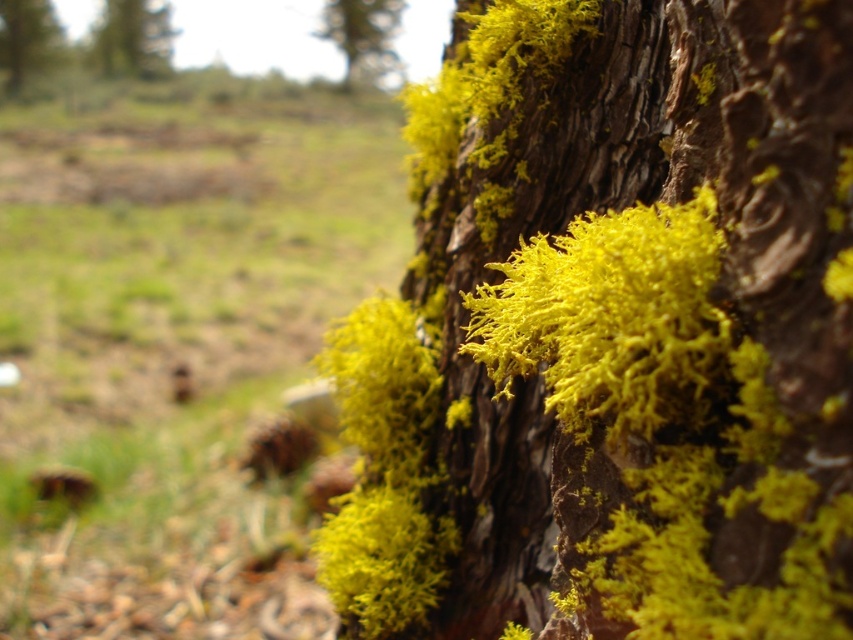
Is yellow mossy bark at upper center closer to the viewer compared to yellow mossy bark at upper left?

Yes, it is in front of yellow mossy bark at upper left.

The image size is (853, 640). I want to click on yellow mossy bark at upper center, so click(363, 36).

Is point (366, 61) farther from viewer compared to point (1, 58)?

No, it is in front of (1, 58).

Find the location of `yellow mossy bark at upper center`. yellow mossy bark at upper center is located at coordinates (363, 36).

Which is below, yellow fuzzy moss at upper left or yellow mossy bark at upper left?

yellow fuzzy moss at upper left is below.

Between yellow fuzzy moss at upper left and yellow mossy bark at upper left, which one appears on the right side from the viewer's perspective?

yellow fuzzy moss at upper left is more to the right.

Who is more distant from viewer, (102, 68) or (22, 54)?

The point (22, 54) is more distant.

The image size is (853, 640). What are the coordinates of `yellow fuzzy moss at upper left` in the screenshot? It's located at (132, 38).

Is yellow fuzzy moss at upper left thinner than yellow mossy bark at upper center?

No.

From the picture: Is yellow fuzzy moss at upper left positioned behind yellow mossy bark at upper center?

Yes, it is behind yellow mossy bark at upper center.

Measure the distance between yellow fuzzy moss at upper left and camera.

They are 7.03 meters apart.

At what (x,y) coordinates should I click in order to perform the action: click on yellow fuzzy moss at upper left. Please return your answer as a coordinate pair (x, y). The width and height of the screenshot is (853, 640). Looking at the image, I should click on (132, 38).